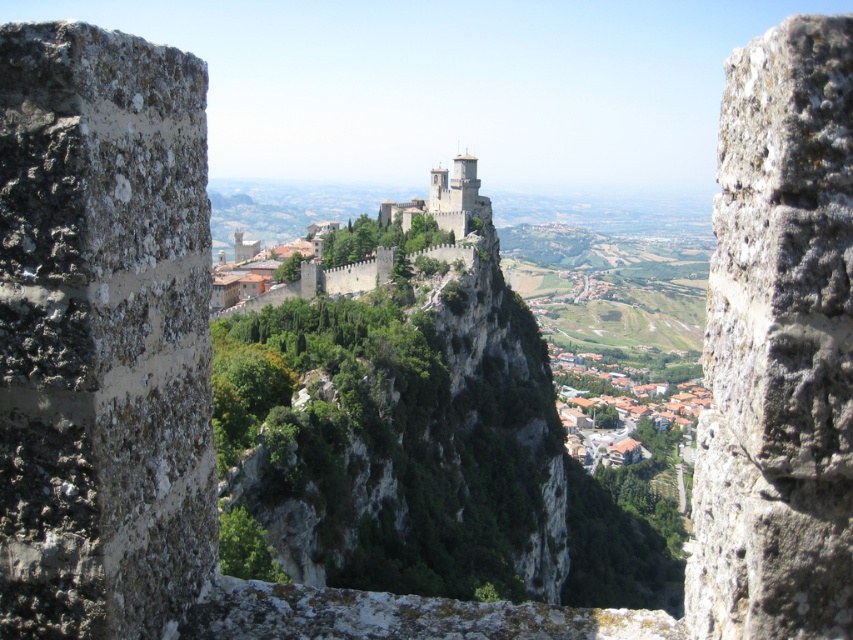
Question: Is rough stone wall at center to the left of stone medieval castle at center from the viewer's perspective?

Choices:
 (A) yes
 (B) no

Answer: (B)

Question: Which point appears closest to the camera in this image?

Choices:
 (A) (846, 356)
 (B) (306, 262)

Answer: (A)

Question: Does rough stone wall at center have a larger size compared to stone medieval castle at center?

Choices:
 (A) yes
 (B) no

Answer: (B)

Question: Among these points, which one is nearest to the camera?

Choices:
 (A) (276, 294)
 (B) (843, 483)

Answer: (B)

Question: Can you confirm if rough stone wall at center is positioned to the left of stone medieval castle at center?

Choices:
 (A) yes
 (B) no

Answer: (B)